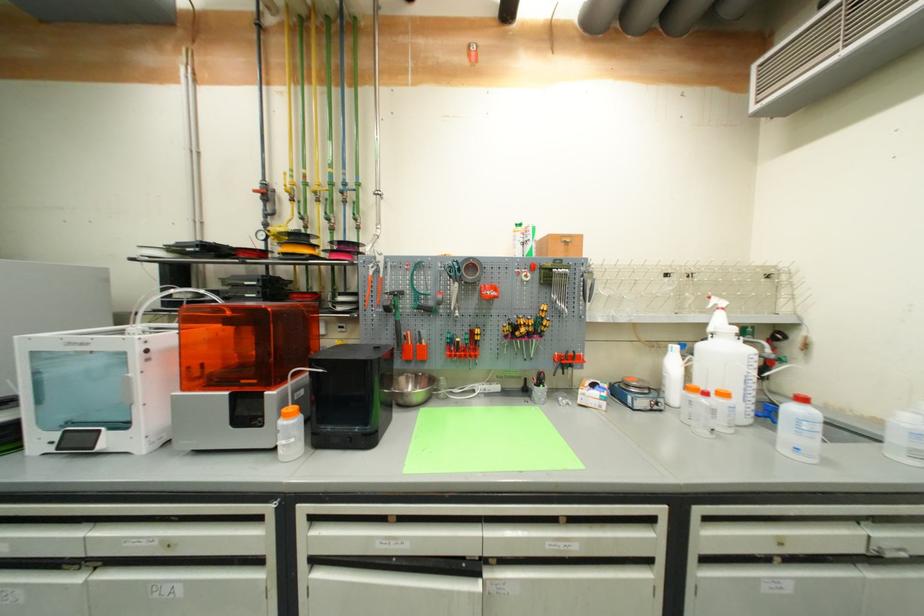
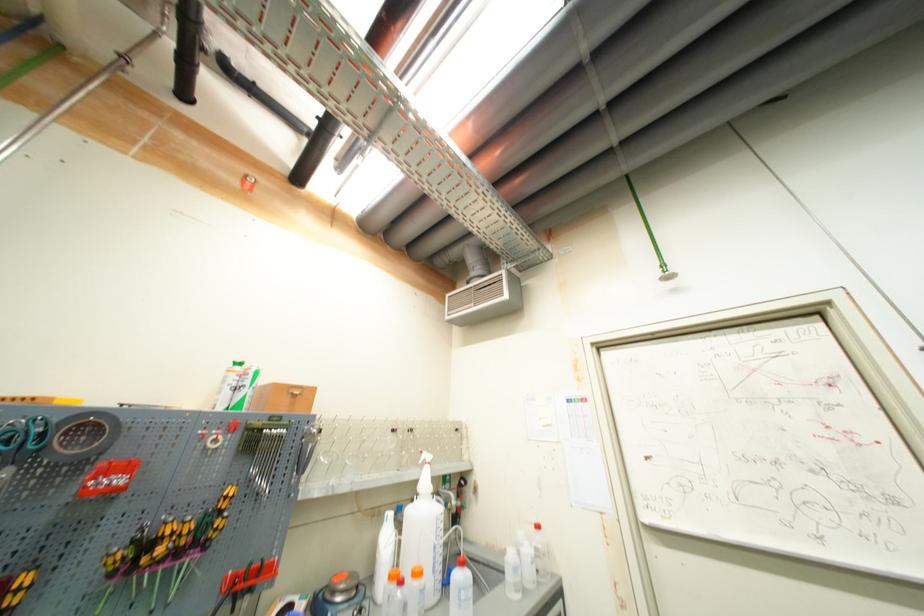
Where in the second image is the point corresponding to point 536,331 from the first image?

(188, 545)